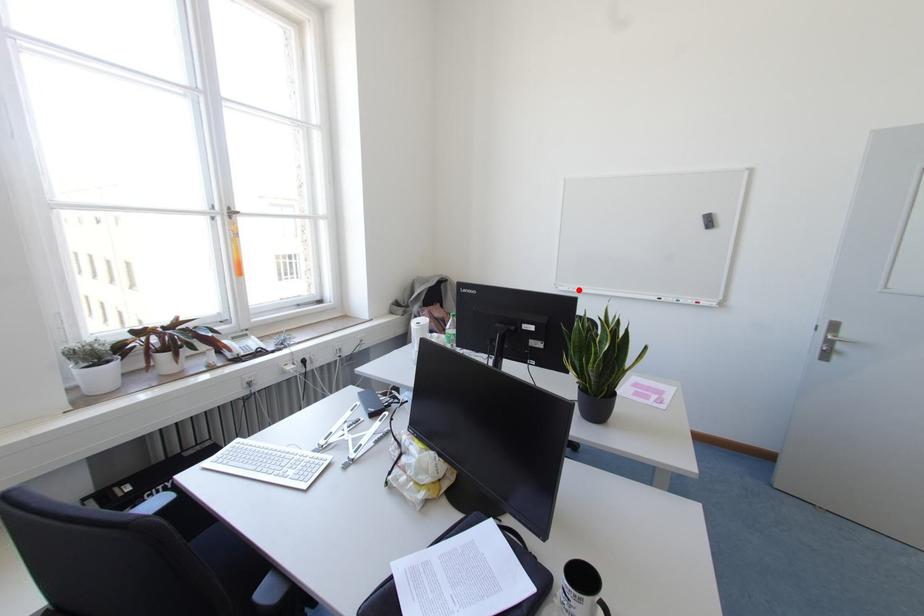
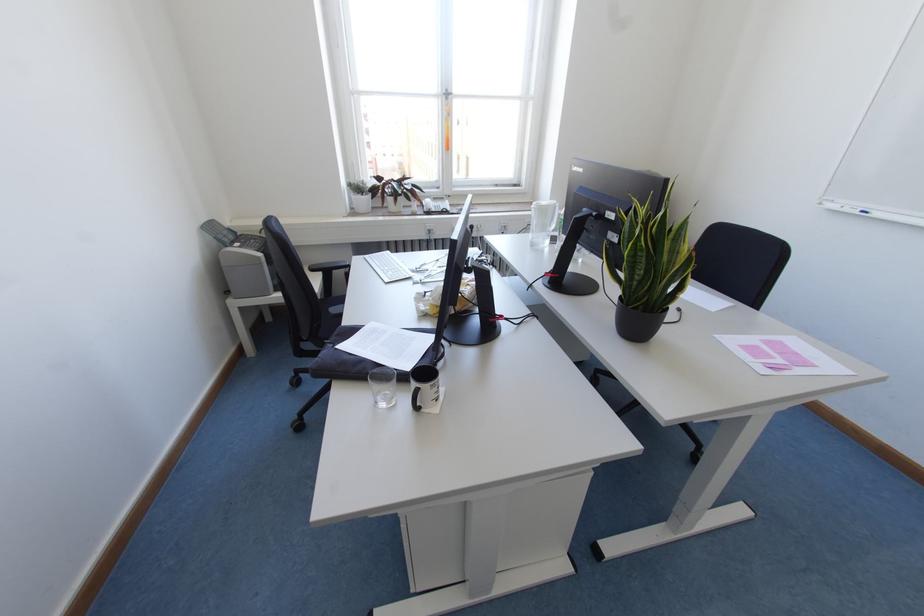
Locate, in the second image, the point that corresponds to the highlighted location in the first image.

(864, 213)